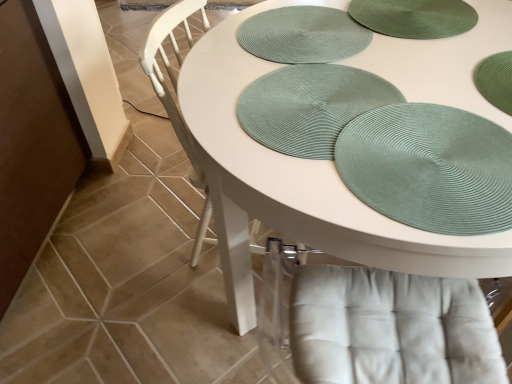
At what (x,y) coordinates should I click in order to perform the action: click on free space to the left of green woven placemat at center, the 2th platter positioned from the back. Please return your answer as a coordinate pair (x, y). This screenshot has height=384, width=512. Looking at the image, I should click on (213, 106).